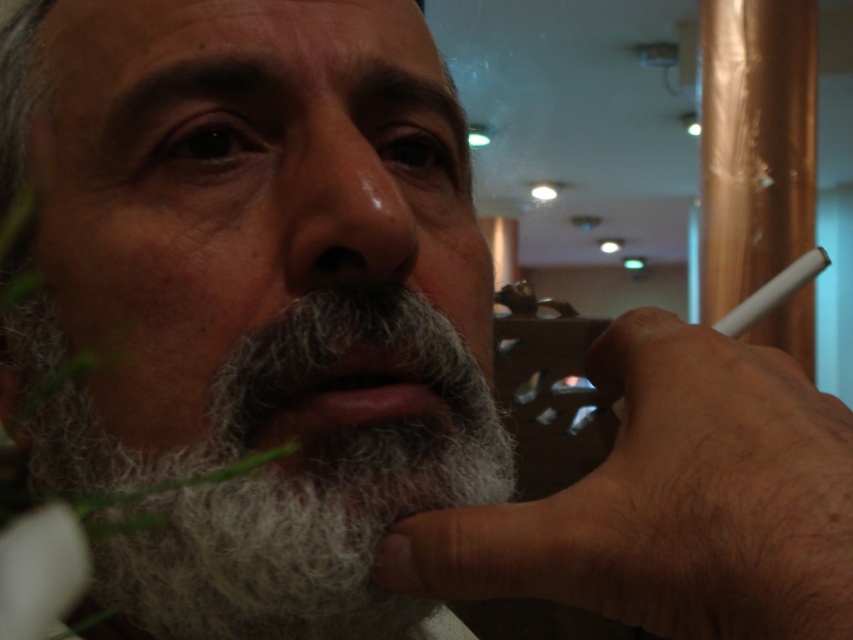
Can you confirm if gray fuzzy beard at lower left is bigger than dry matte nose at center?

Indeed, gray fuzzy beard at lower left has a larger size compared to dry matte nose at center.

Can you confirm if gray fuzzy beard at lower left is positioned to the left of dry matte nose at center?

Yes, gray fuzzy beard at lower left is to the left of dry matte nose at center.

Locate an element on the screen. This screenshot has height=640, width=853. gray fuzzy beard at lower left is located at coordinates (286, 481).